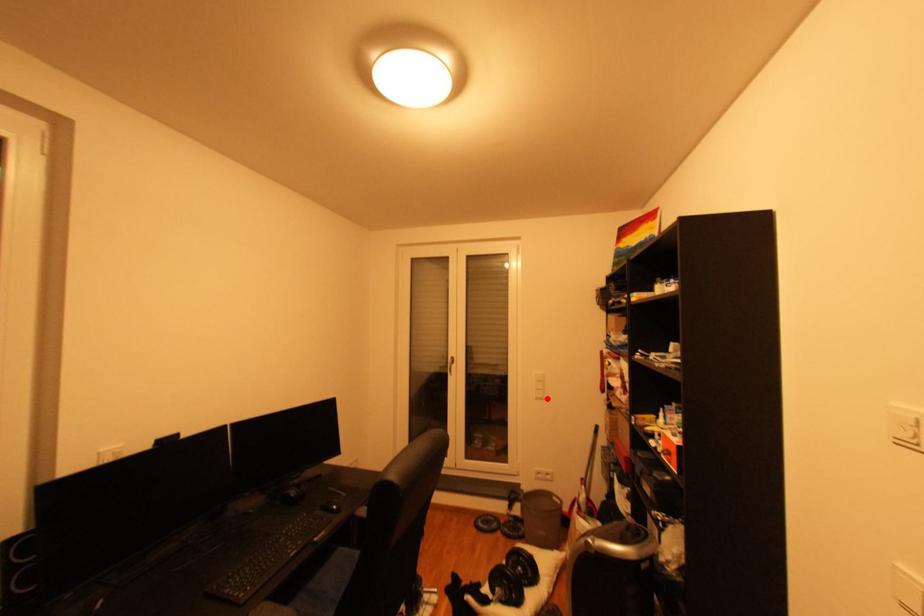
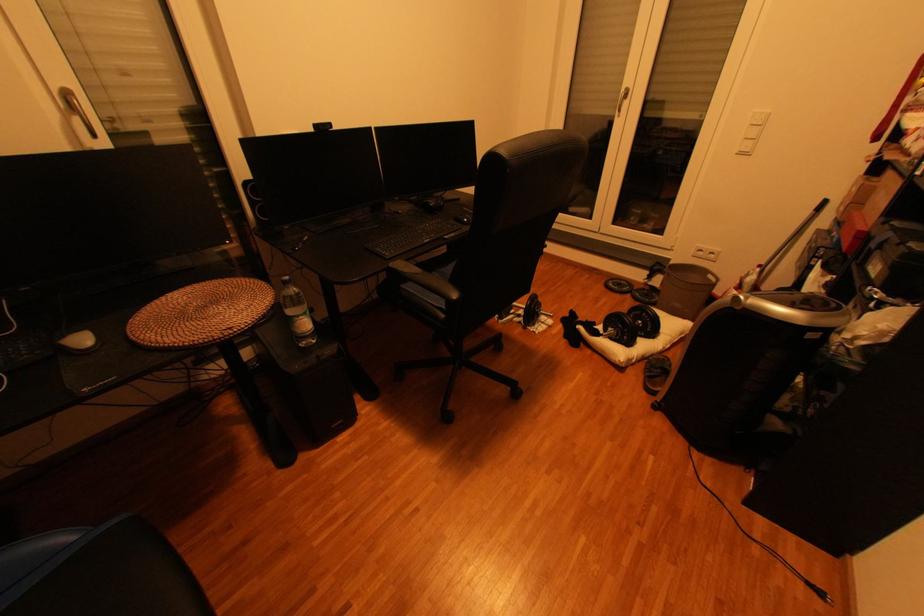
Question: I am providing you with two images of the same scene from different viewpoints. Image1 has a red point marked. In image2, the corresponding 3D location appears at what relative position? Reply with the corresponding letter.

Choices:
 (A) Closer
 (B) Farther

Answer: (A)